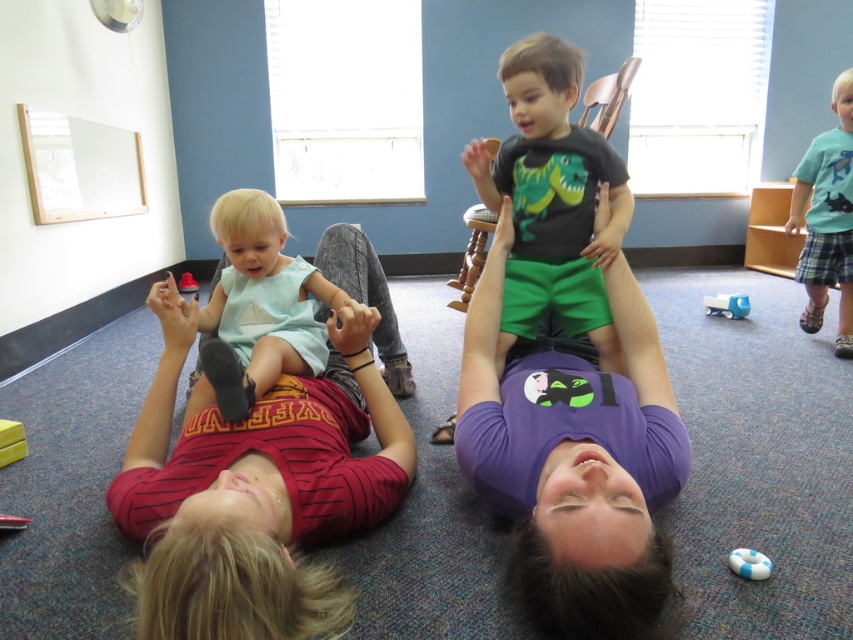
Question: Is purple soft t-shirt at center positioned at the back of blue plastic toy at center?

Choices:
 (A) yes
 (B) no

Answer: (B)

Question: Observing the image, what is the correct spatial positioning of blue rubber ring at lower center in reference to rubberized plastic toy at center?

Choices:
 (A) right
 (B) left

Answer: (A)

Question: Which of the following is the farthest from the observer?

Choices:
 (A) blue plaid shorts at right
 (B) light blue fabric baby at center

Answer: (A)

Question: Which of the following is the farthest from the observer?

Choices:
 (A) purple soft t-shirt at center
 (B) blue plaid shorts at right
 (C) matte red shirt at upper left
 (D) green cotton shorts at center

Answer: (B)

Question: Where is matte red shirt at upper left located in relation to blue plastic toy at center in the image?

Choices:
 (A) below
 (B) above

Answer: (A)

Question: Which object appears farthest from the camera in this image?

Choices:
 (A) purple soft t-shirt at center
 (B) green cotton shorts at center

Answer: (B)